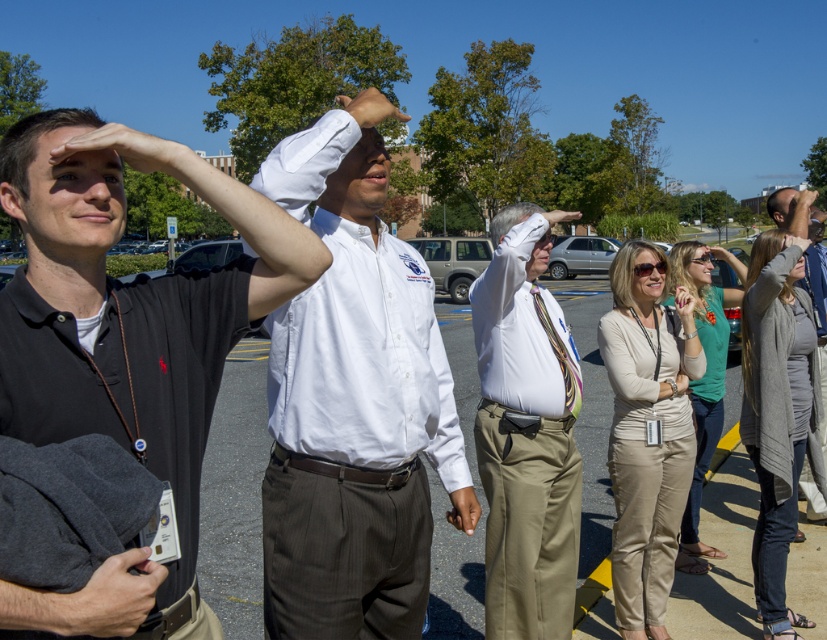
Does white cotton shirt at center lie in front of gray wool cardigan at upper right?

That is True.

Is point (375, 148) in front of point (825, 262)?

Yes, it is in front of point (825, 262).

Which is in front, point (331, 417) or point (806, 214)?

Point (331, 417) is in front.

You are a GUI agent. You are given a task and a screenshot of the screen. Output one action in this format:
    pyautogui.click(x=<x>, y=<y>)
    Task: Click on the white cotton shirt at center
    The width and height of the screenshot is (827, 640).
    Given the screenshot: What is the action you would take?
    pyautogui.click(x=352, y=400)

Does matte black shirt at left have a lesser width compared to light beige pants at center?

No.

Between point (3, 385) and point (567, 612), which one is positioned in front?

Point (3, 385) is more forward.

Between point (261, 276) and point (576, 465), which one is positioned in front?

Point (261, 276) is more forward.

In order to click on matte black shirt at left in this screenshot , I will do `click(125, 342)`.

Based on the photo, can you confirm if light beige pants at center is bigger than gray wool cardigan at upper right?

Incorrect, light beige pants at center is not larger than gray wool cardigan at upper right.

The height and width of the screenshot is (640, 827). I want to click on light beige pants at center, so click(526, 433).

Does point (543, 353) lie in front of point (810, 486)?

That is True.

At what (x,y) coordinates should I click in order to perform the action: click on light beige pants at center. Please return your answer as a coordinate pair (x, y). The image size is (827, 640). Looking at the image, I should click on (526, 433).